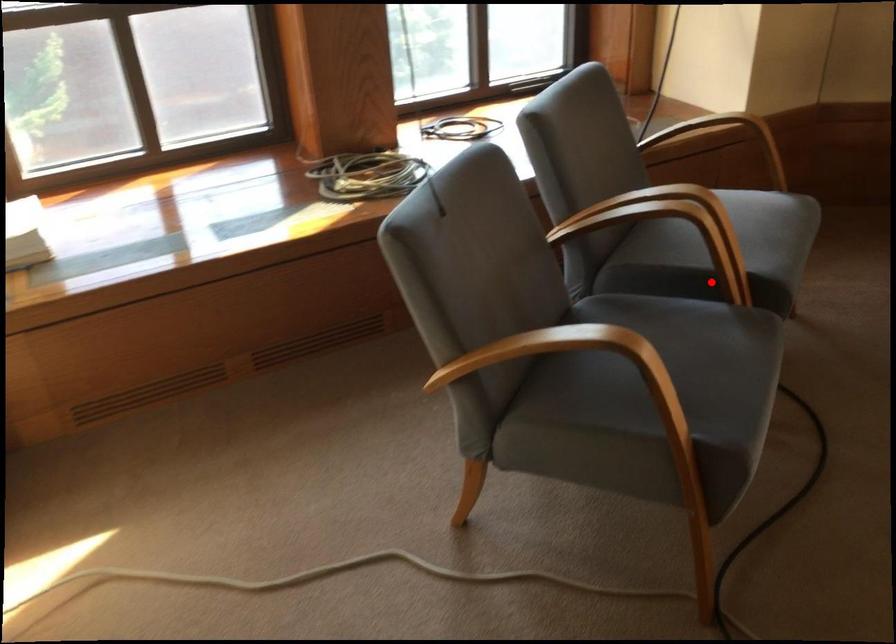
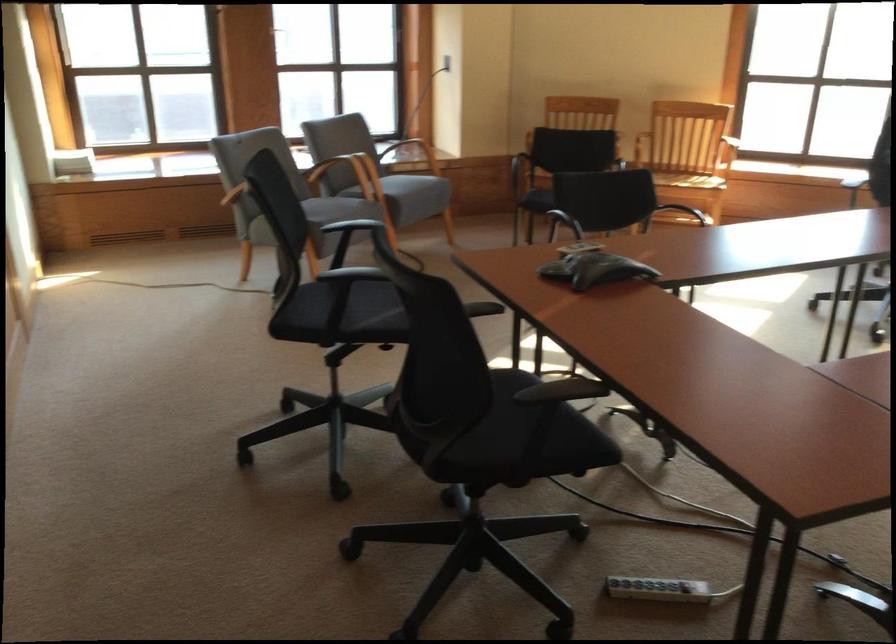
The point at the highlighted location is marked in the first image. Where is the corresponding point in the second image?

(362, 178)